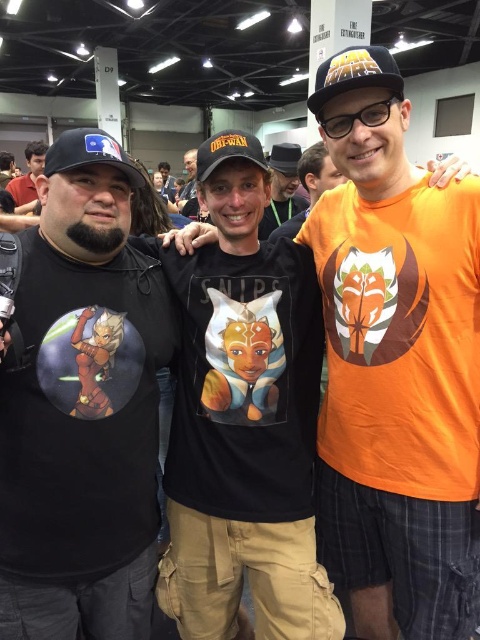
Which is more to the right, black matte baseball cap at center or black felt baseball hat at center?

From the viewer's perspective, black felt baseball hat at center appears more on the right side.

Is black matte baseball cap at center above black felt baseball hat at center?

Actually, black matte baseball cap at center is below black felt baseball hat at center.

At what (x,y) coordinates should I click in order to perform the action: click on black matte baseball cap at center. Please return your answer as a coordinate pair (x, y). The width and height of the screenshot is (480, 640). Looking at the image, I should click on (228, 150).

Identify the location of black matte baseball cap at center. This screenshot has width=480, height=640. (228, 150).

Does black matte t-shirt at left have a lesser height compared to black matte baseball cap at upper center?

No, black matte t-shirt at left is not shorter than black matte baseball cap at upper center.

Who is shorter, black matte t-shirt at left or black matte baseball cap at upper center?

With less height is black matte baseball cap at upper center.

Who is more forward, (72, 556) or (379, 45)?

Point (72, 556) is in front.

You are a GUI agent. You are given a task and a screenshot of the screen. Output one action in this format:
    pyautogui.click(x=<x>, y=<y>)
    Task: Click on the black matte t-shirt at left
    Image resolution: width=480 pixels, height=640 pixels.
    Given the screenshot: What is the action you would take?
    pyautogui.click(x=83, y=406)

Can you confirm if matte black cap at center is thinner than black felt baseball hat at center?

In fact, matte black cap at center might be wider than black felt baseball hat at center.

Is matte black cap at center to the left of black felt baseball hat at center from the viewer's perspective?

Indeed, matte black cap at center is positioned on the left side of black felt baseball hat at center.

Identify the location of matte black cap at center. The width and height of the screenshot is (480, 640). (282, 188).